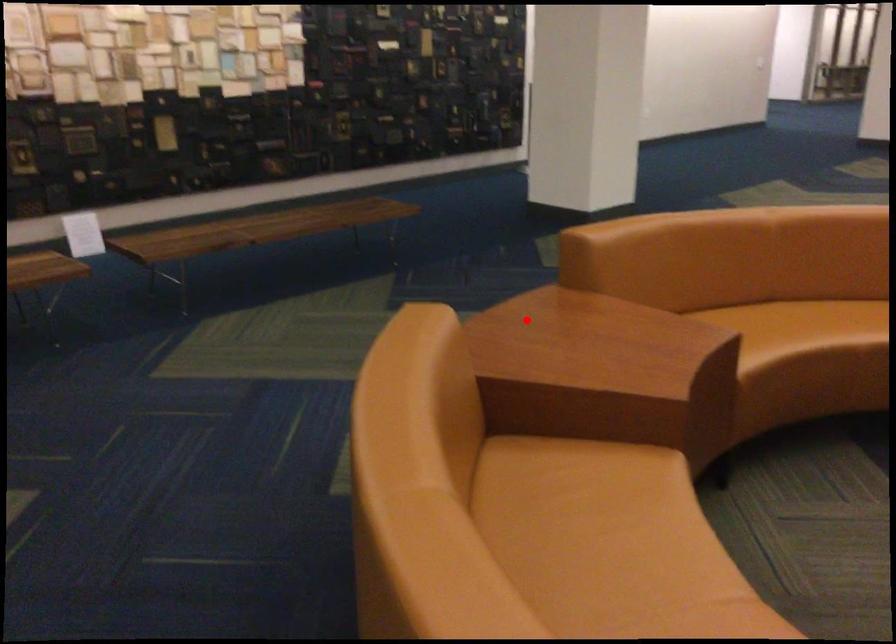
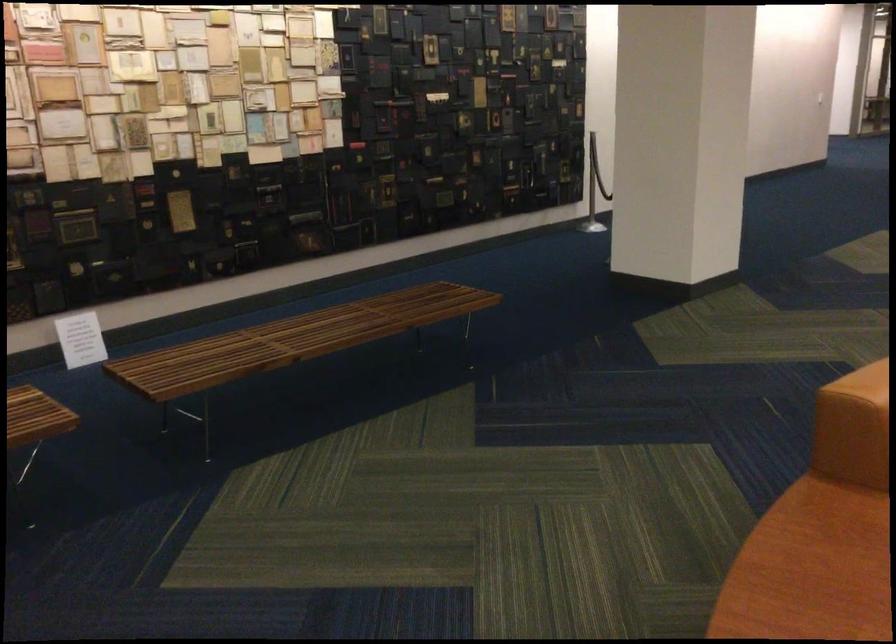
Question: I am providing you with two images of the same scene from different viewpoints. Given a red point in image1, look at the same physical point in image2. Is it:

Choices:
 (A) Closer to the viewpoint
 (B) Farther from the viewpoint

Answer: (A)